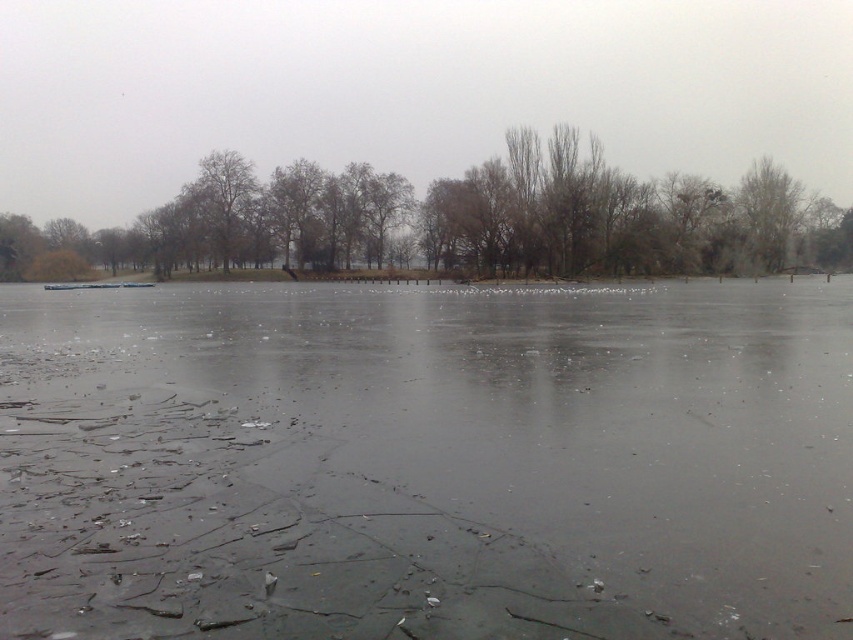
Question: Which of the following is the closest to the observer?

Choices:
 (A) transparent ice at center
 (B) brown leafless trees at upper center
 (C) bare branches at upper right

Answer: (A)

Question: Which object is closer to the camera taking this photo?

Choices:
 (A) bare branches at upper right
 (B) transparent ice at center
 (C) brown leafless trees at upper center

Answer: (B)

Question: Considering the relative positions of transparent ice at center and brown leafless trees at upper center in the image provided, where is transparent ice at center located with respect to brown leafless trees at upper center?

Choices:
 (A) below
 (B) above

Answer: (A)

Question: Can you confirm if transparent ice at center is positioned above bare branches at upper right?

Choices:
 (A) no
 (B) yes

Answer: (A)

Question: Which is nearer to the bare branches at upper right?

Choices:
 (A) brown leafless trees at upper center
 (B) transparent ice at center

Answer: (A)

Question: Is transparent ice at center smaller than bare branches at upper right?

Choices:
 (A) no
 (B) yes

Answer: (B)